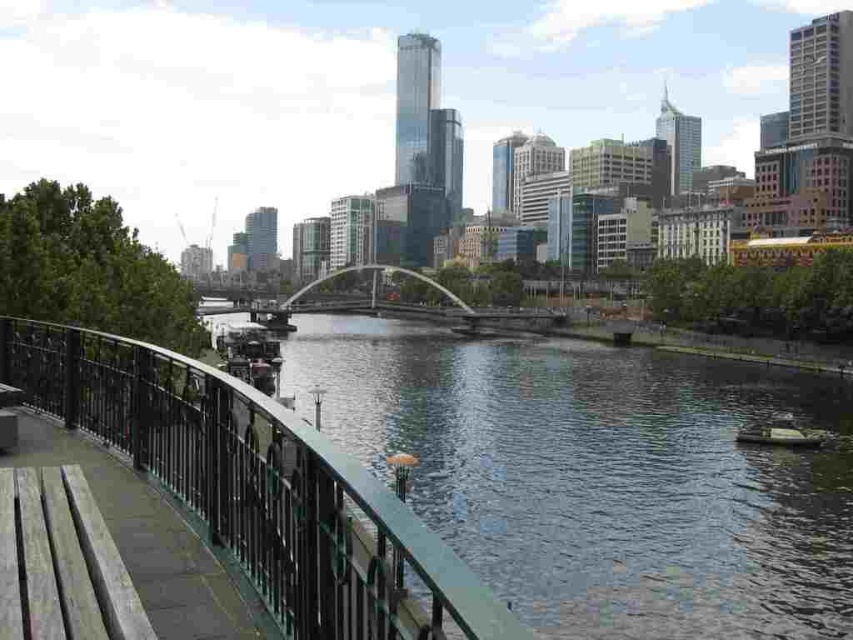
Question: Does green metallic waterway at center have a greater width compared to green plastic boat at lower right?

Choices:
 (A) no
 (B) yes

Answer: (B)

Question: Among these objects, which one is farthest from the camera?

Choices:
 (A) green plastic boat at lower right
 (B) silver metallic bridge at center
 (C) green metallic waterway at center
 (D) green painted metal railing at lower left

Answer: (B)

Question: Is silver metallic bridge at center further to camera compared to green plastic boat at lower right?

Choices:
 (A) yes
 (B) no

Answer: (A)

Question: From the image, what is the correct spatial relationship of green painted metal railing at lower left in relation to green plastic boat at lower right?

Choices:
 (A) above
 (B) below

Answer: (A)

Question: Which of the following is the farthest from the observer?

Choices:
 (A) green plastic boat at lower right
 (B) green metallic waterway at center

Answer: (A)

Question: Based on their relative distances, which object is farther from the silver metallic bridge at center?

Choices:
 (A) green metallic waterway at center
 (B) green painted metal railing at lower left
 (C) green plastic boat at lower right

Answer: (B)